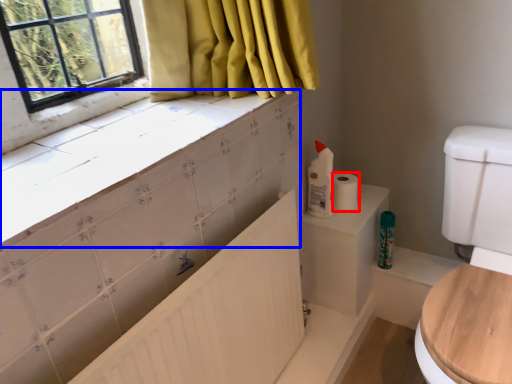
Question: Which of the following is the closest to the observer, toilet paper (highlighted by a red box) or counter top (highlighted by a blue box)?

Choices:
 (A) toilet paper
 (B) counter top

Answer: (B)